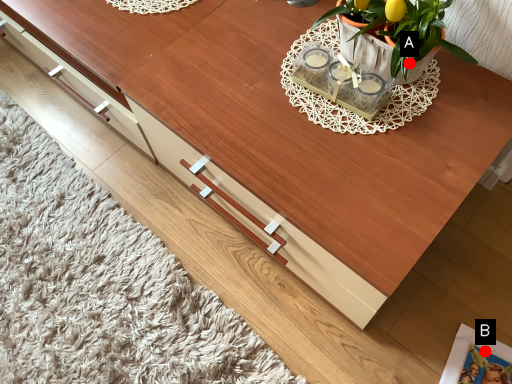
Question: Two points are circled on the image, labeled by A and B beside each circle. Which point is further to the camera?

Choices:
 (A) A is further
 (B) B is further

Answer: (B)